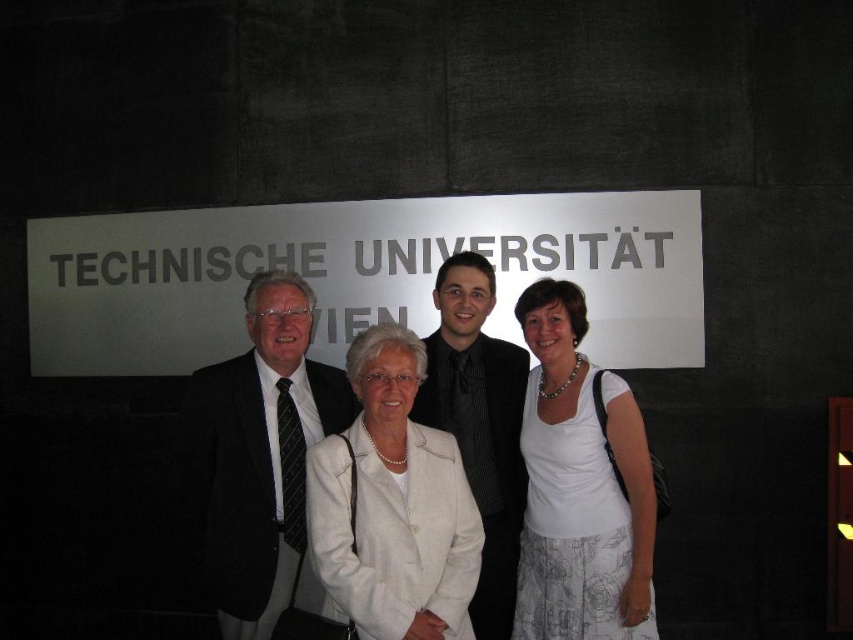
Is point (262, 273) farther from camera compared to point (418, 346)?

Yes, point (262, 273) is farther from viewer.

From the picture: Does dark suit at center appear under white fabric coat at center?

Actually, dark suit at center is above white fabric coat at center.

Is point (271, 499) behind point (440, 550)?

Yes.

Locate an element on the screen. dark suit at center is located at coordinates click(257, 454).

Who is lower down, dark suit at center or black textured suit at center?

black textured suit at center

Measure the distance from dark suit at center to black textured suit at center.

A distance of 26.83 inches exists between dark suit at center and black textured suit at center.

Locate an element on the screen. This screenshot has height=640, width=853. dark suit at center is located at coordinates (257, 454).

Looking at this image, who is taller, dark suit at center or white fabric skirt at center?

Standing taller between the two is white fabric skirt at center.

The width and height of the screenshot is (853, 640). What do you see at coordinates (257, 454) in the screenshot? I see `dark suit at center` at bounding box center [257, 454].

You are a GUI agent. You are given a task and a screenshot of the screen. Output one action in this format:
    pyautogui.click(x=<x>, y=<y>)
    Task: Click on the dark suit at center
    The width and height of the screenshot is (853, 640).
    Given the screenshot: What is the action you would take?
    pyautogui.click(x=257, y=454)